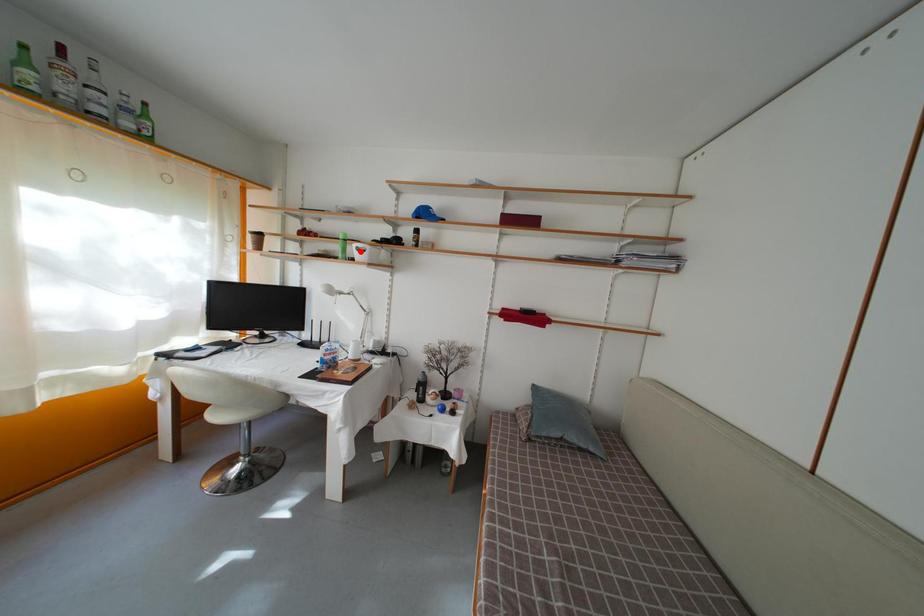
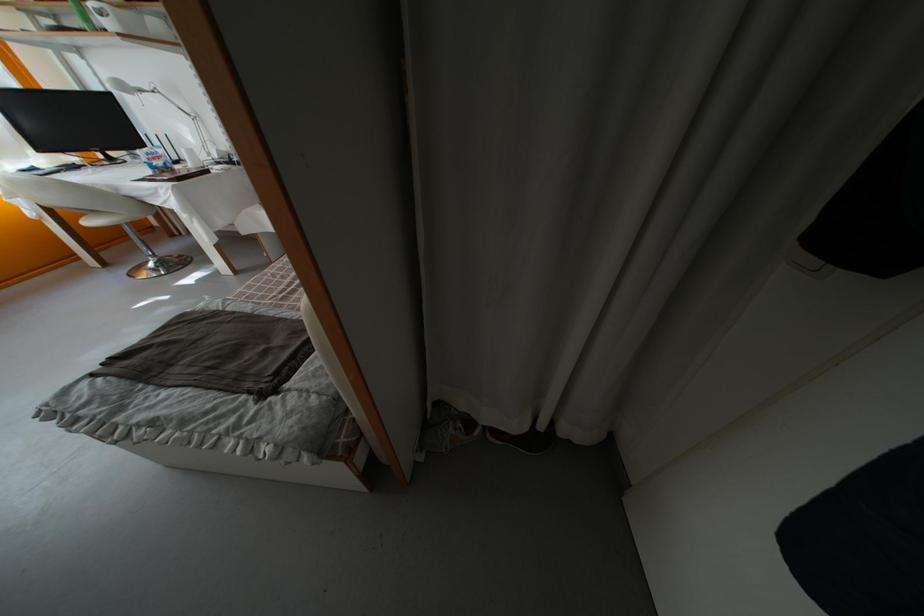
Question: I am providing you with two images of the same scene from different viewpoints. In image1, a red point is highlighted. Considering the same 3D point in image2, which of the following is correct?

Choices:
 (A) It is closer
 (B) It is farther

Answer: (B)